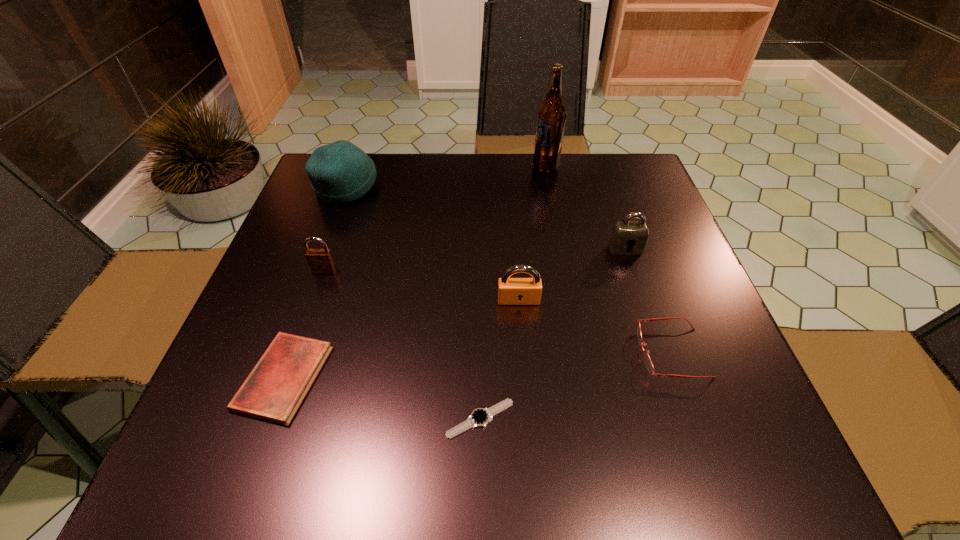
Find the location of `the seventh tallest object`. the seventh tallest object is located at coordinates coord(273,391).

Locate an element on the screen. This screenshot has height=540, width=960. watch is located at coordinates (480, 417).

Locate an element on the screen. This screenshot has width=960, height=540. free space located on the label of the third object from right to left is located at coordinates (478, 167).

Where is `free region located 0.060m on the label of the third object from right to left`? This screenshot has width=960, height=540. free region located 0.060m on the label of the third object from right to left is located at coordinates (511, 167).

You are a GUI agent. You are given a task and a screenshot of the screen. Output one action in this format:
    pyautogui.click(x=<x>, y=<y>)
    Task: Click on the free space located 0.360m on the label of the third object from right to left
    The image size is (960, 540).
    Given the screenshot: What is the action you would take?
    pyautogui.click(x=400, y=167)

The width and height of the screenshot is (960, 540). Identify the location of vacant space located 0.380m on the right of the second tallest object. (526, 188).

Locate an element on the screen. This screenshot has height=540, width=960. vacant point located at the front of the sixth nearest object near the keyhole is located at coordinates pos(659,347).

Locate an element on the screen. The height and width of the screenshot is (540, 960). free space located 0.230m to unlock the fourth nearest object from the front is located at coordinates (528, 416).

The image size is (960, 540). Identify the location of free space located on the front-facing side of the leftmost padlock. (292, 365).

At what (x,y) coordinates should I click in order to perform the action: click on blank space located 0.390m on the lenses of the third shortest object. Please return your answer as a coordinate pair (x, y). The width and height of the screenshot is (960, 540). Looking at the image, I should click on (419, 353).